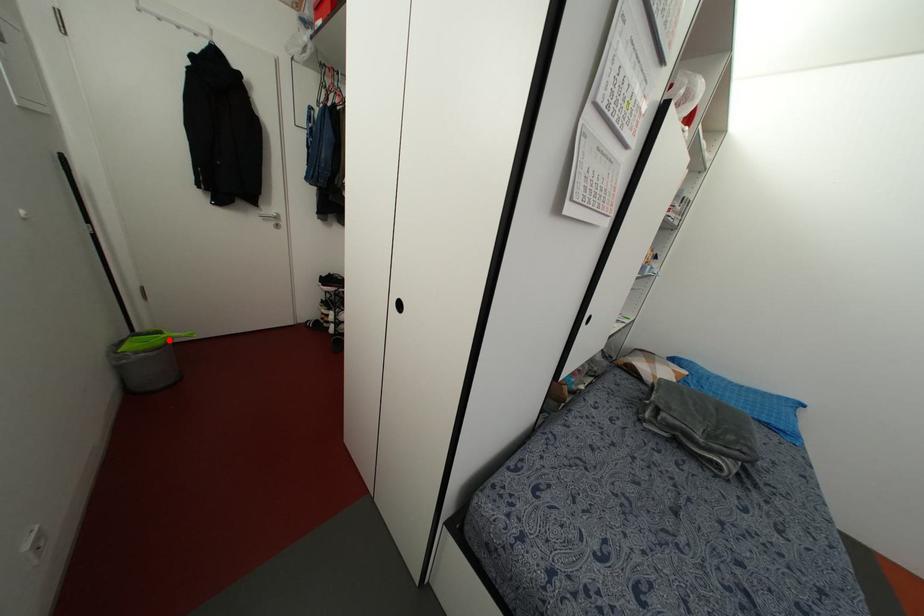
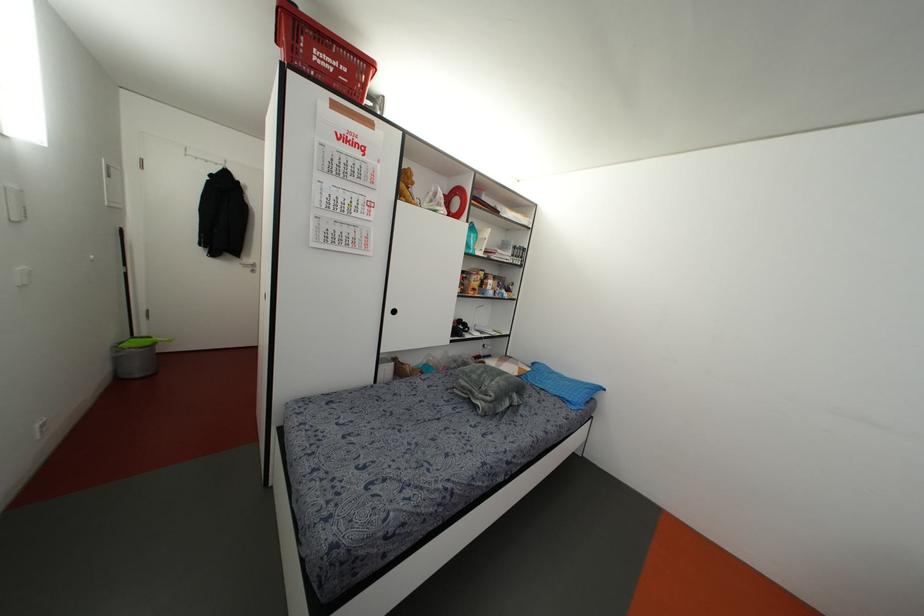
Question: I am providing you with two images of the same scene from different viewpoints. Given a red point in image1, look at the same physical point in image2. Is it:

Choices:
 (A) Closer to the viewpoint
 (B) Farther from the viewpoint

Answer: (B)